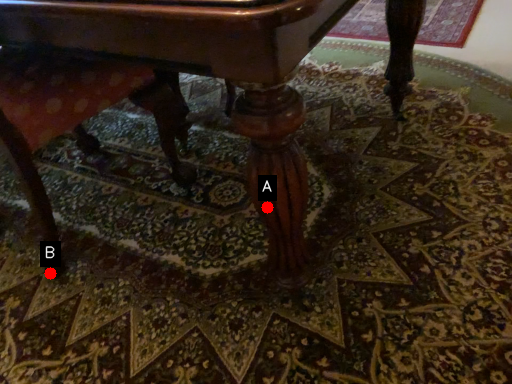
Question: Two points are circled on the image, labeled by A and B beside each circle. Which point is farther from the camera taking this photo?

Choices:
 (A) A is further
 (B) B is further

Answer: (B)